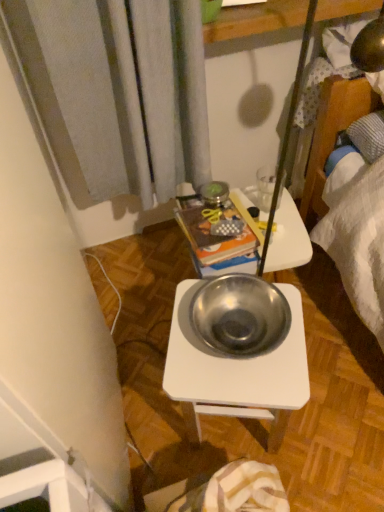
Image resolution: width=384 pixels, height=512 pixels. In order to click on vacant space to the left of metallic white desk at center in this screenshot , I will do `click(148, 407)`.